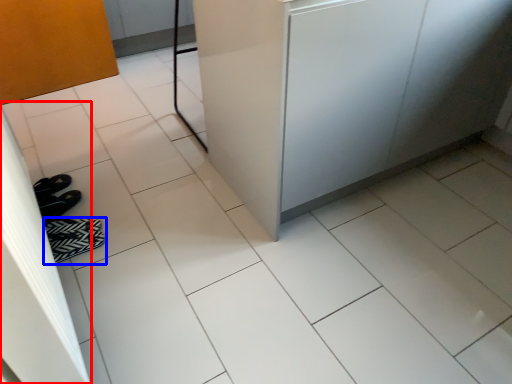
Question: Which of the following is the farthest to the observer, screen door (highlighted by a red box) or footwear (highlighted by a blue box)?

Choices:
 (A) screen door
 (B) footwear

Answer: (B)